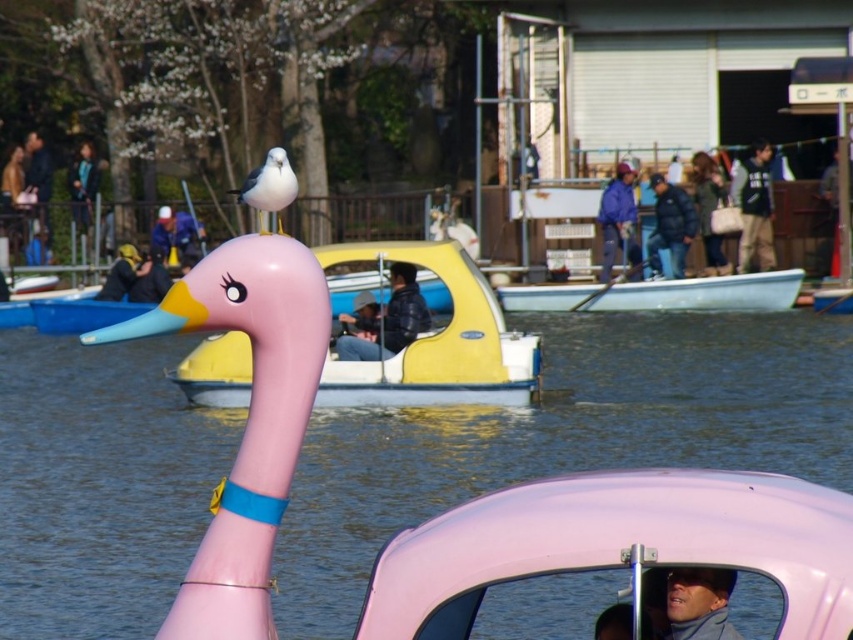
Can you confirm if pink rubber duck boat at center is taller than white glossy seagull at upper center?

Yes, pink rubber duck boat at center is taller than white glossy seagull at upper center.

Who is positioned more to the right, pink rubber duck boat at center or white glossy seagull at upper center?

From the viewer's perspective, pink rubber duck boat at center appears more on the right side.

What are the coordinates of `pink rubber duck boat at center` in the screenshot? It's located at (432, 337).

I want to click on pink rubber duck boat at center, so click(x=432, y=337).

Which is more to the left, pink rubber duck boat at center or dark blue jacket at center?

dark blue jacket at center is more to the left.

Which is above, pink rubber duck boat at center or dark blue jacket at center?

dark blue jacket at center is higher up.

Between point (340, 368) and point (131, 269), which one is positioned in front?

Point (340, 368)

At what (x,y) coordinates should I click in order to perform the action: click on pink rubber duck boat at center. Please return your answer as a coordinate pair (x, y). This screenshot has width=853, height=640. Looking at the image, I should click on (432, 337).

Does matte pink rubber duck at center have a smaller size compared to smooth blue jacket at lower center?

Yes, matte pink rubber duck at center is smaller than smooth blue jacket at lower center.

Between matte pink rubber duck at center and smooth blue jacket at lower center, which one has less height?

matte pink rubber duck at center is shorter.

Locate an element on the screen. The image size is (853, 640). matte pink rubber duck at center is located at coordinates (247, 419).